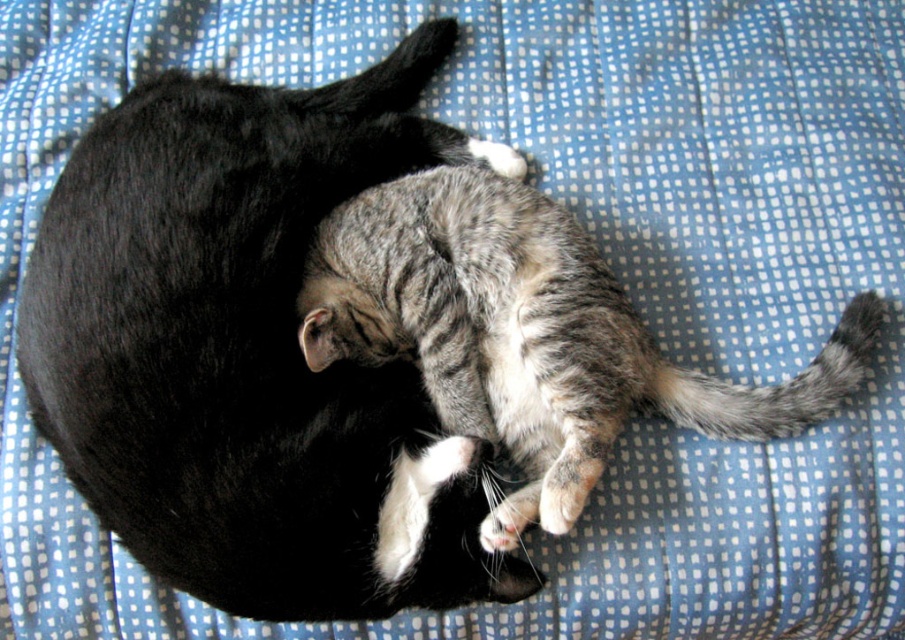
Question: Can you confirm if soft fur cat at center is positioned above gray striped fur cat at center?

Choices:
 (A) yes
 (B) no

Answer: (A)

Question: Which point appears closest to the camera in this image?

Choices:
 (A) (508, 273)
 (B) (262, 266)

Answer: (B)

Question: Can you confirm if soft fur cat at center is positioned below gray striped fur cat at center?

Choices:
 (A) no
 (B) yes

Answer: (A)

Question: In this image, where is soft fur cat at center located relative to gray striped fur cat at center?

Choices:
 (A) left
 (B) right

Answer: (A)

Question: Which point is farther to the camera?

Choices:
 (A) (189, 456)
 (B) (354, 342)

Answer: (B)